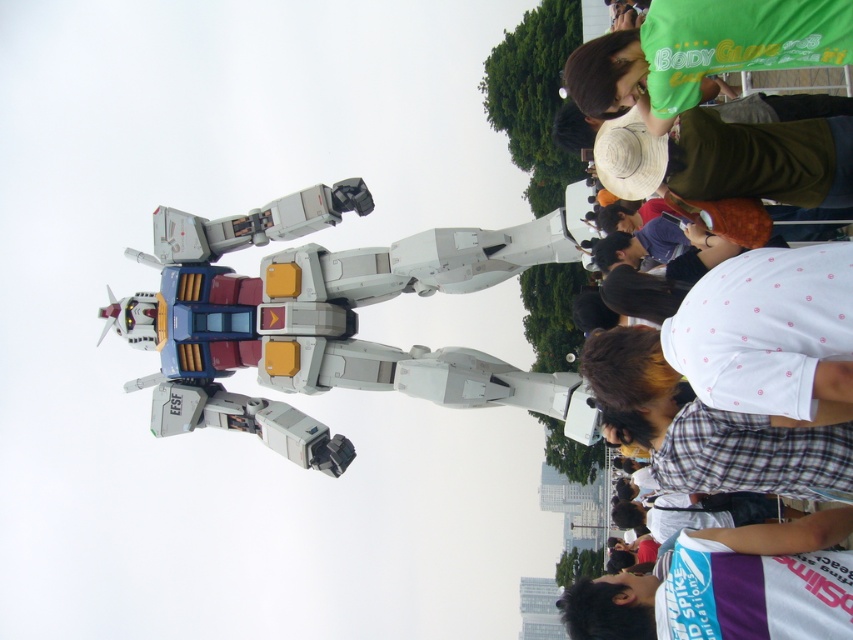
You are a photographer trying to capture a clear shot of the robot statue. You notice two white items in the frame that might distract the viewer. The white dotted shirt at upper right and the white fabric at lower right are both in your view. Which of these two items is located more to the left in the image?

The white dotted shirt at upper right is positioned on the left side of the white fabric at lower right, so it is more to the left.

You are a photographer trying to capture a clear shot of the green fabric shirt at upper right and the white fabric at lower right. Which object should you focus on first if you want to ensure both are in focus without adjusting the camera settings?

The green fabric shirt at upper right is above the white fabric at lower right, so focusing on the green fabric shirt at upper right first would help ensure both are in focus since it is closer to the camera.